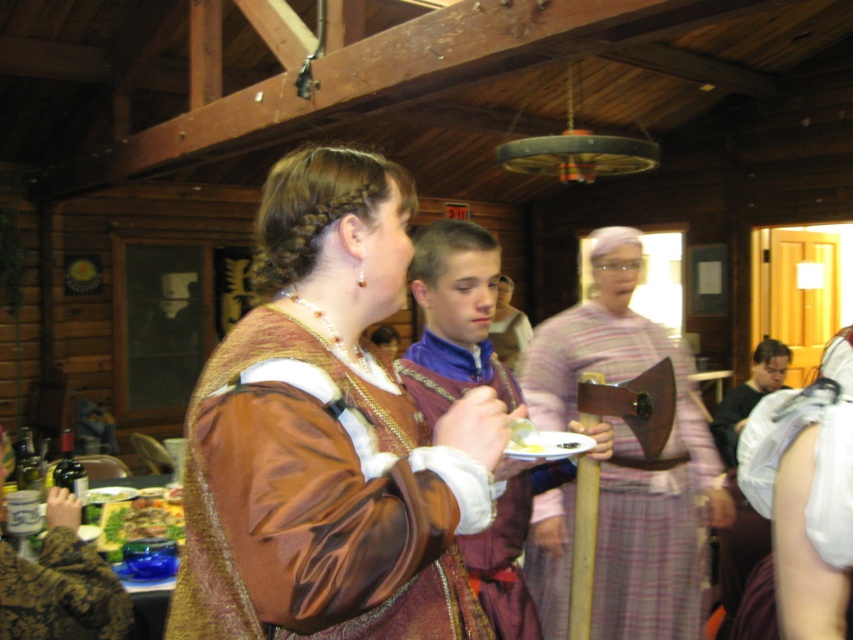
You are a guest at this event and want to take a photo of the satin brown dress at center and the plaid fabric axe at center. Which object should you focus on first to ensure both are in frame?

You should focus on the satin brown dress at center first since it is above the plaid fabric axe at center, making it easier to frame both in the photo.

You are a guest at this event and want to know the position of the dark green fabric shirt at right relative to the purple satin shirt at center. Which direction is it in?

The dark green fabric shirt at right is below the purple satin shirt at center.

You are a guest at this event and want to take a photo of both the white satin dress at lower right and the green leafy salad at lower left. Which object should you focus on first to ensure both are in the frame?

You should focus on the green leafy salad at lower left first because the white satin dress at lower right is positioned to its right, so by centering the salad, the dress will naturally fall into the frame on the right side.